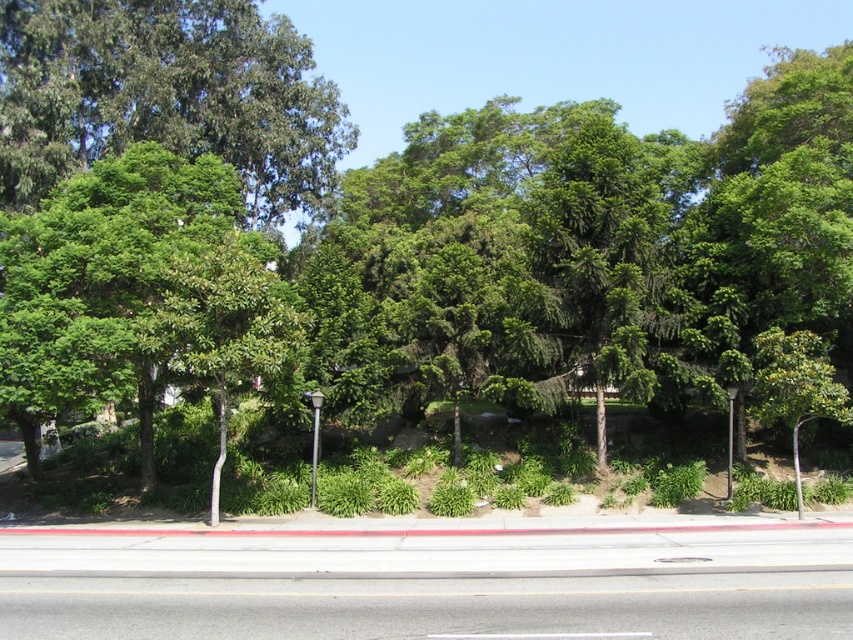
You are standing at the point marked by the coordinates point (165, 93) in the image. Which object is directly in front of you?

The point (165, 93) marks green leafy tree at upper left, so the green leafy tree at upper left is directly in front of you.

You are a pedestrian standing at the edge of the road. You see the green leafy tree at center and the black metal pole at center. Which object is closer to your right side?

The black metal pole at center is closer to your right side because the green leafy tree at center is to the left of it.

You are a city planner reviewing this area. You need to determine if the green leafy tree at upper left could potentially block the view of the black metal pole at center. Based on their positions, what do you observe?

The green leafy tree at upper left is positioned over the black metal pole at center, so it could block the view of the black metal pole at center.